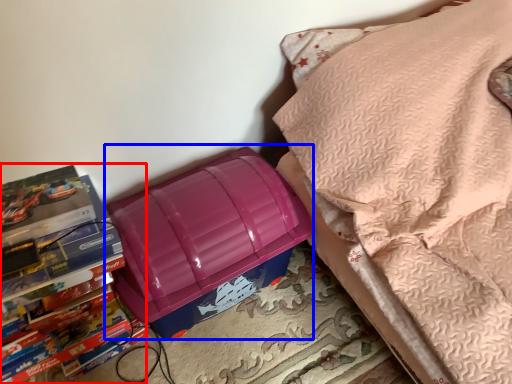
Question: Which point is closer to the camera, book (highlighted by a red box) or lunch box (highlighted by a blue box)?

Choices:
 (A) book
 (B) lunch box

Answer: (A)